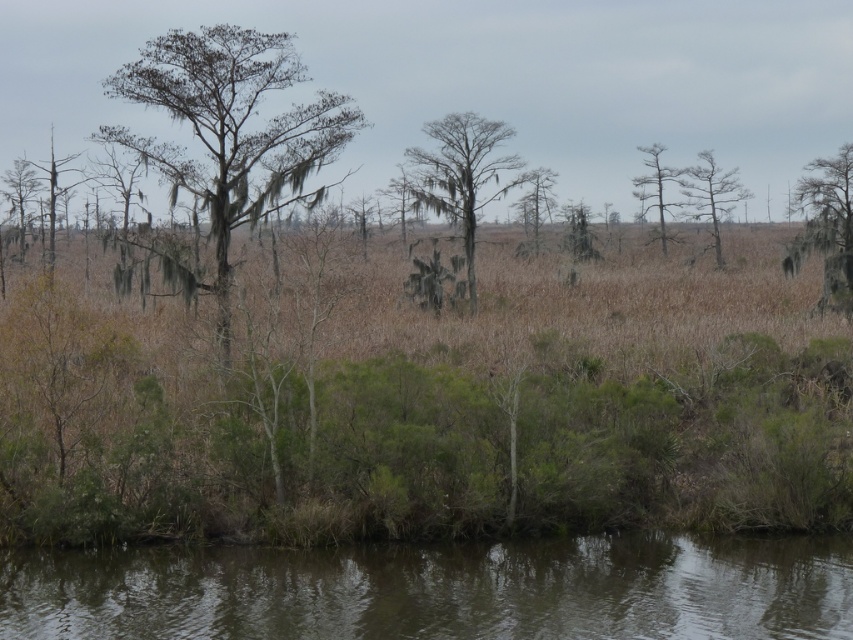
Question: Which is nearer to the brown murky water at lower center?

Choices:
 (A) smooth bark tree at center
 (B) green mossy tree at center
 (C) smooth gray tree at upper right
 (D) bare wood tree at right

Answer: (B)

Question: Is brown murky water at lower center below green mossy tree at upper right?

Choices:
 (A) no
 (B) yes

Answer: (B)

Question: Which point is farther to the camera?

Choices:
 (A) (653, 180)
 (B) (839, 195)
 (C) (540, 563)
 (D) (543, 189)

Answer: (D)

Question: Which object appears farthest from the camera in this image?

Choices:
 (A) smooth bark tree at center
 (B) bare wood tree at right
 (C) smooth gray tree at upper right
 (D) green mossy tree at upper right

Answer: (C)

Question: Is green mossy tree at upper right smaller than green mossy tree at left?

Choices:
 (A) no
 (B) yes

Answer: (A)

Question: Does brown murky water at lower center appear under green mossy tree at center?

Choices:
 (A) no
 (B) yes

Answer: (B)